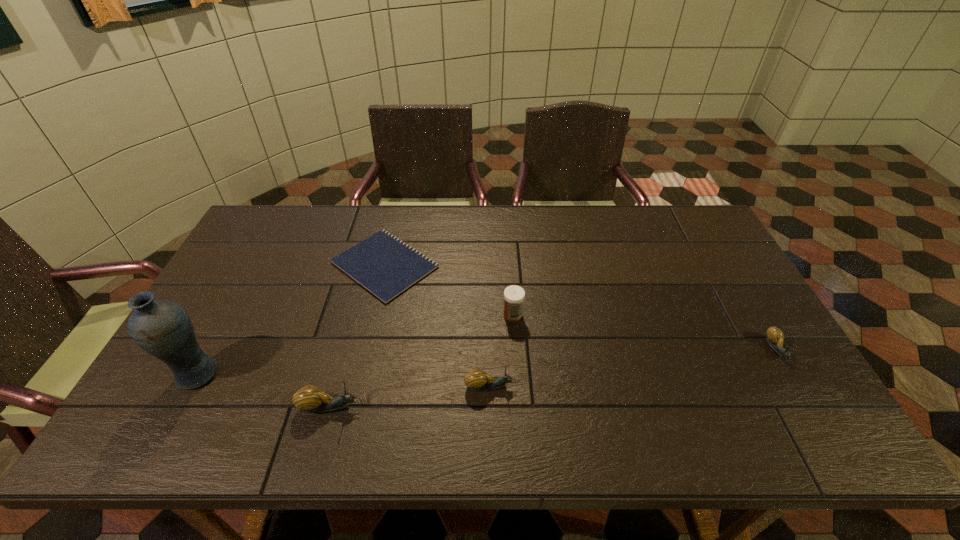
If we want them evenly spaced by inserting an extra escargot among them, please locate a free spot for this new escargot. Please provide its 2D coordinates. Your answer should be formatted as a tuple, i.e. [(x, y)], where the tuple contains the x and y coordinates of a point satisfying the conditions above.

[(638, 367)]